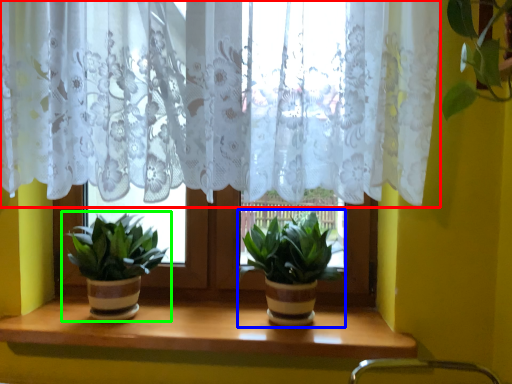
Question: Considering the real-world distances, which object is closest to curtain (highlighted by a red box)? houseplant (highlighted by a blue box) or houseplant (highlighted by a green box).

Choices:
 (A) houseplant
 (B) houseplant

Answer: (A)